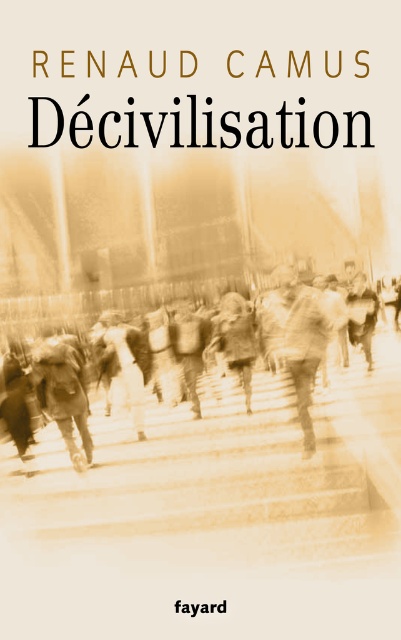
Measure the distance between point (x=240, y=484) and camera.

They are 111.90 feet apart.

Is sepia stone stairs at center further to camera compared to sepia textured crowd at center?

That is False.

Is point (346, 481) in front of point (119, 392)?

Yes, it is.

Locate an element on the screen. The width and height of the screenshot is (401, 640). sepia stone stairs at center is located at coordinates (224, 480).